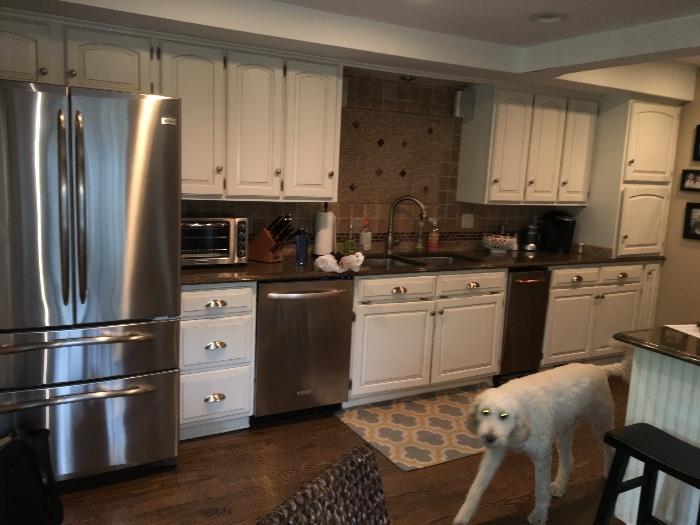
Find the location of a particular element. drawer pull is located at coordinates (216, 304), (214, 344), (217, 398), (397, 291), (475, 285), (578, 278), (624, 278).